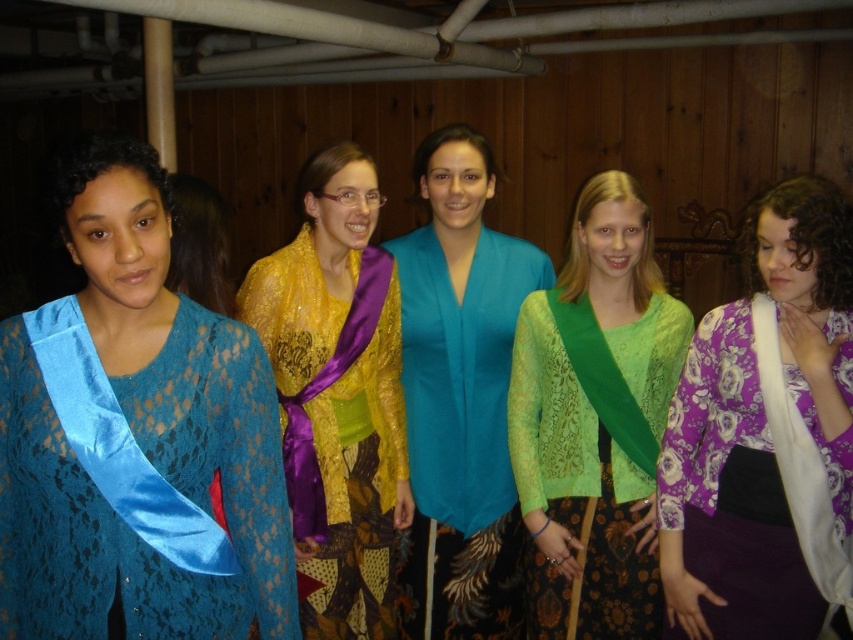
You are organizing a pageant and need to ensure all sashes are visible. The blue satin sash at left and the satin blue sash at left are both part of the participants. Which sash should you adjust to ensure visibility if one is wider than the other?

The blue satin sash at left is wider than the satin blue sash at left, so you should adjust the blue satin sash at left to ensure it doesn not obstruct the view of the other sash.

You are standing at the entrance of the basement and see two points marked in the image. The first point is at coordinates point [387,580] and the second is at point [117,493]. If you want to move from the entrance to the first point without passing through the second point, which direction should you move relative to the second point?

Since point [387,580] is behind point [117,493], you should move behind the second point to reach the first point without passing through it.